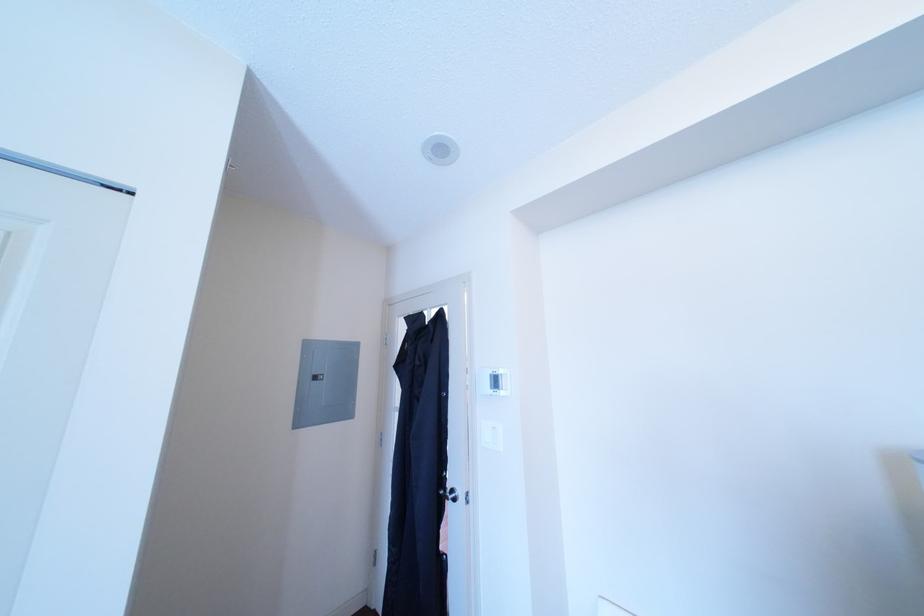
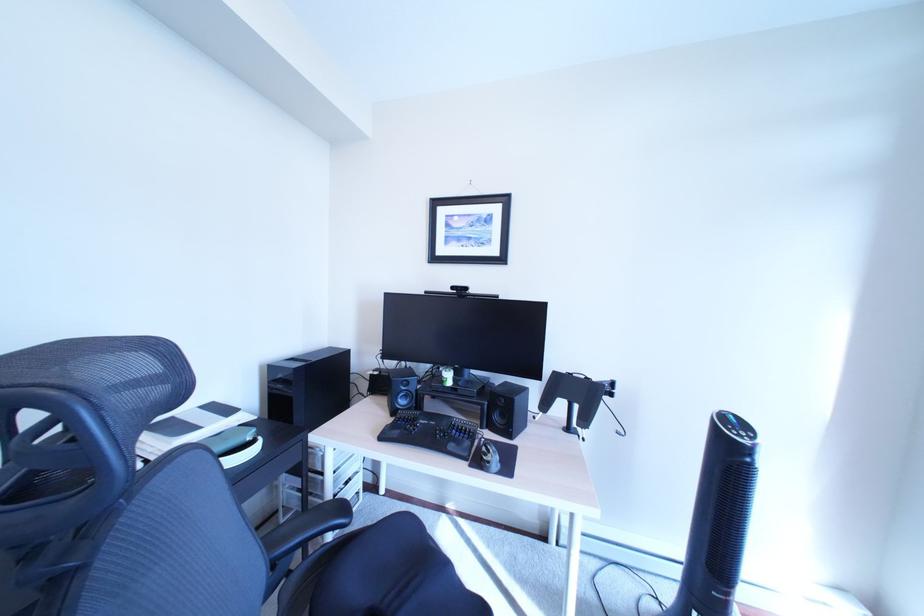
Question: The images are taken continuously from a first-person perspective. In which direction is your viewpoint rotating?

Choices:
 (A) Left
 (B) Right
 (C) Up
 (D) Down

Answer: (B)